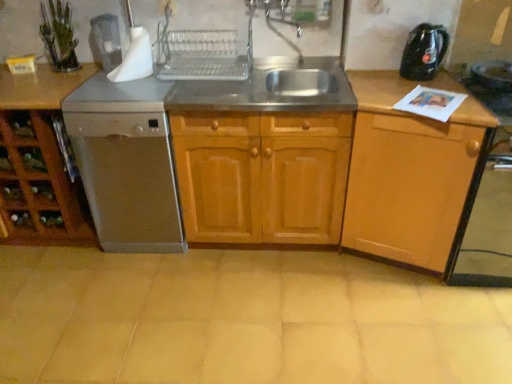
Question: Does beige ceramic tile at center turn towards brown wood cabinet at left, the 3th cabinetry viewed from the right?

Choices:
 (A) no
 (B) yes

Answer: (A)

Question: Does beige ceramic tile at center have a smaller size compared to brown wood cabinet at left, the 3th cabinetry viewed from the right?

Choices:
 (A) yes
 (B) no

Answer: (A)

Question: Considering the relative sizes of beige ceramic tile at center and brown wood cabinet at left, the 3th cabinetry viewed from the right, in the image provided, is beige ceramic tile at center taller than brown wood cabinet at left, the 3th cabinetry viewed from the right,?

Choices:
 (A) no
 (B) yes

Answer: (A)

Question: Does beige ceramic tile at center appear on the left side of brown wood cabinet at left, which ranks as the 1th cabinetry in left-to-right order?

Choices:
 (A) no
 (B) yes

Answer: (A)

Question: Would you say beige ceramic tile at center contains brown wood cabinet at left, which ranks as the 1th cabinetry in left-to-right order?

Choices:
 (A) no
 (B) yes

Answer: (A)

Question: Based on their sizes in the image, would you say wooden cabinet at center, which is counted as the second cabinetry, starting from the right, is bigger or smaller than clear glass dish rack at upper center?

Choices:
 (A) small
 (B) big

Answer: (B)

Question: In terms of height, does wooden cabinet at center, placed as the 2th cabinetry when sorted from left to right, look taller or shorter compared to clear glass dish rack at upper center?

Choices:
 (A) short
 (B) tall

Answer: (B)

Question: Considering their positions, is wooden cabinet at center, placed as the 2th cabinetry when sorted from left to right, located in front of or behind clear glass dish rack at upper center?

Choices:
 (A) behind
 (B) front

Answer: (B)

Question: Is point (241, 167) positioned closer to the camera than point (217, 59)?

Choices:
 (A) farther
 (B) closer

Answer: (B)

Question: Is satin white coffee machine at upper left taller or shorter than black plastic kettle at upper right?

Choices:
 (A) short
 (B) tall

Answer: (B)

Question: Visually, is satin white coffee machine at upper left positioned to the left or to the right of black plastic kettle at upper right?

Choices:
 (A) left
 (B) right

Answer: (A)

Question: Relative to black plastic kettle at upper right, is satin white coffee machine at upper left in front or behind?

Choices:
 (A) front
 (B) behind

Answer: (B)

Question: From the image's perspective, is satin white coffee machine at upper left above or below black plastic kettle at upper right?

Choices:
 (A) below
 (B) above

Answer: (B)

Question: Does point (294, 102) appear closer or farther from the camera than point (291, 208)?

Choices:
 (A) farther
 (B) closer

Answer: (B)

Question: Considering the relative positions of stainless steel sink at center and wooden cabinet at center, placed as the 2th cabinetry when sorted from left to right, in the image provided, is stainless steel sink at center to the left or to the right of wooden cabinet at center, placed as the 2th cabinetry when sorted from left to right,?

Choices:
 (A) left
 (B) right

Answer: (A)